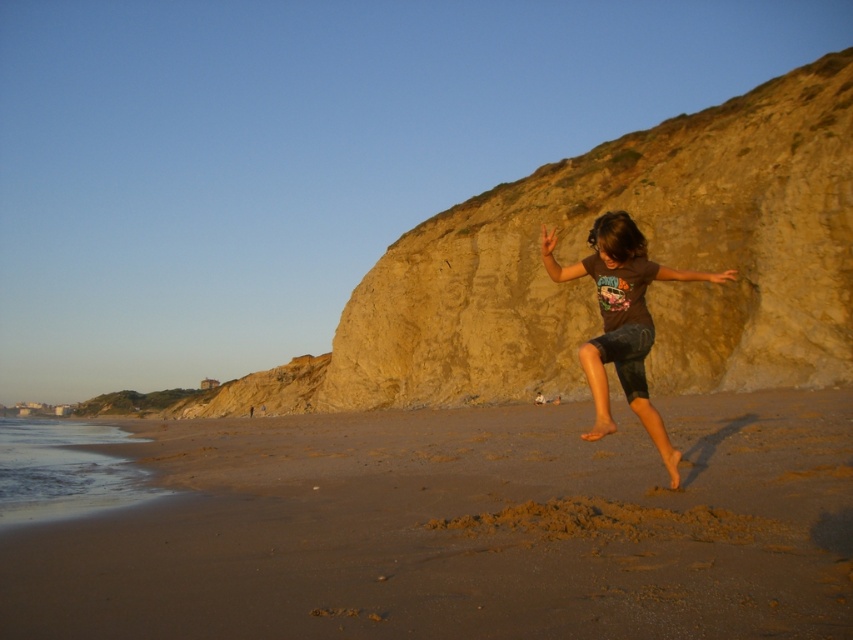
Question: Which object appears farthest from the camera in this image?

Choices:
 (A) brown sandy beach at center
 (B) brown cotton t-shirt at center

Answer: (B)

Question: Which point is farther from the camera taking this photo?

Choices:
 (A) (801, 557)
 (B) (581, 352)

Answer: (B)

Question: Among these objects, which one is nearest to the camera?

Choices:
 (A) brown sandy beach at center
 (B) brown cotton t-shirt at center

Answer: (A)

Question: Is brown sandy beach at center to the left of brown cotton t-shirt at center from the viewer's perspective?

Choices:
 (A) no
 (B) yes

Answer: (B)

Question: Is brown sandy beach at center bigger than brown cotton t-shirt at center?

Choices:
 (A) no
 (B) yes

Answer: (B)

Question: Does brown sandy beach at center have a lesser width compared to brown cotton t-shirt at center?

Choices:
 (A) no
 (B) yes

Answer: (A)